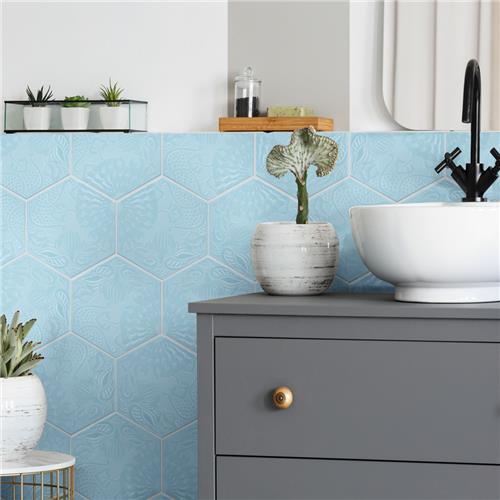
The height and width of the screenshot is (500, 500). What are the coordinates of `faucet` in the screenshot? It's located at (466, 112).